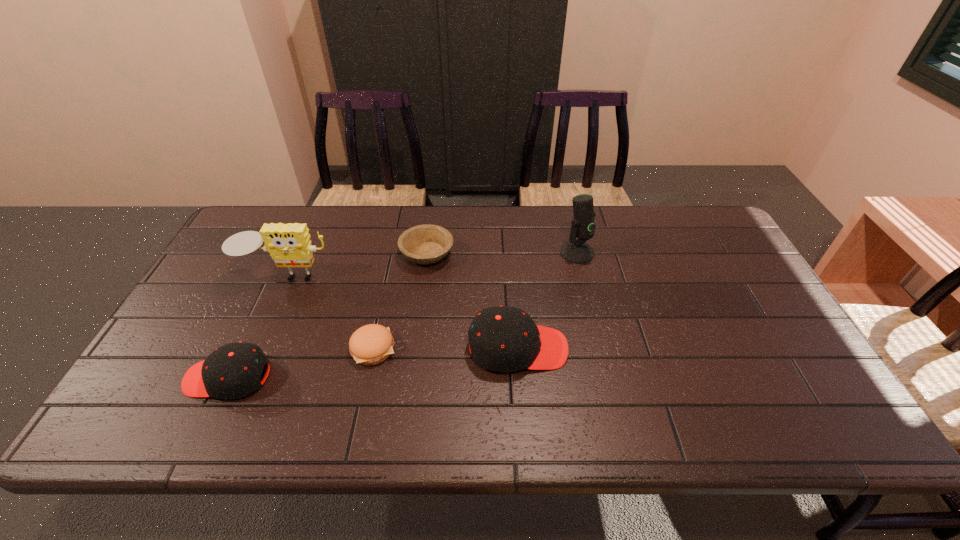
In the image, there is a desktop. What are the coordinates of `free space at the far edge` in the screenshot? It's located at (334, 238).

This screenshot has height=540, width=960. In order to click on free spot at the near edge of the desktop in this screenshot , I will do `click(656, 389)`.

Where is `free space at the left edge`? This screenshot has height=540, width=960. free space at the left edge is located at coordinates (249, 281).

Where is `vacant space at the right edge`? This screenshot has height=540, width=960. vacant space at the right edge is located at coordinates (805, 365).

The height and width of the screenshot is (540, 960). What are the coordinates of `free space at the far left corner of the desktop` in the screenshot? It's located at (249, 230).

Identify the location of vacant area at the far right corner. (706, 230).

This screenshot has height=540, width=960. Identify the location of vacant region between the microphone and the sponge. (432, 264).

Identify the location of vacant point located between the sponge and the taller cap. (402, 312).

Identify the location of free spot between the patty and the taller cap. (445, 348).

At what (x,y) coordinates should I click in order to perform the action: click on unoccupied area between the third shortest object and the microphone. Please return your answer as a coordinate pair (x, y). Looking at the image, I should click on 402,315.